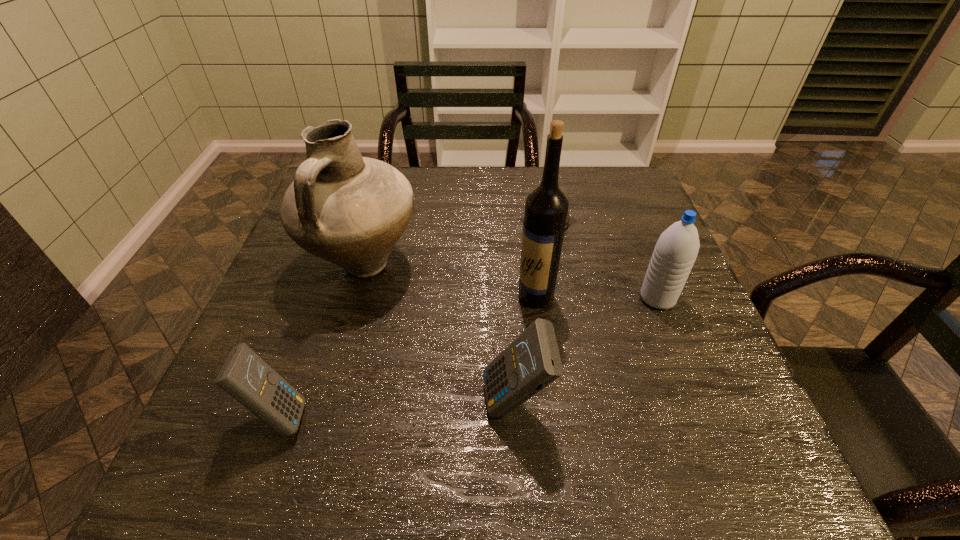
At what (x,y) coordinates should I click in order to perform the action: click on the left calculator. Please return your answer as a coordinate pair (x, y). Looking at the image, I should click on (244, 375).

Locate an element on the screen. The height and width of the screenshot is (540, 960). the shorter calculator is located at coordinates (244, 375).

Where is `the right calculator`? the right calculator is located at coordinates (532, 361).

The height and width of the screenshot is (540, 960). I want to click on the third shortest object, so click(x=532, y=361).

Where is `chocolate cake`? chocolate cake is located at coordinates (568, 216).

Identify the location of the second tallest object. The width and height of the screenshot is (960, 540). (350, 210).

The height and width of the screenshot is (540, 960). Identify the location of water bottle. (676, 250).

You are a GUI agent. You are given a task and a screenshot of the screen. Output one action in this format:
    pyautogui.click(x=<x>, y=<y>)
    Task: Click on the rightmost object
    
    Given the screenshot: What is the action you would take?
    pyautogui.click(x=676, y=250)

Find the location of `wine bottle`. wine bottle is located at coordinates coord(546,208).

Identify the location of free spot located on the front-facing side of the shorter calculator. (511, 416).